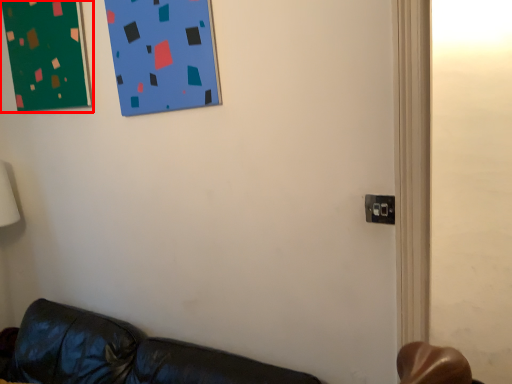
Question: From the image's perspective, where is bulletin board (annotated by the red box) located in relation to electric outlet in the image?

Choices:
 (A) above
 (B) below

Answer: (A)